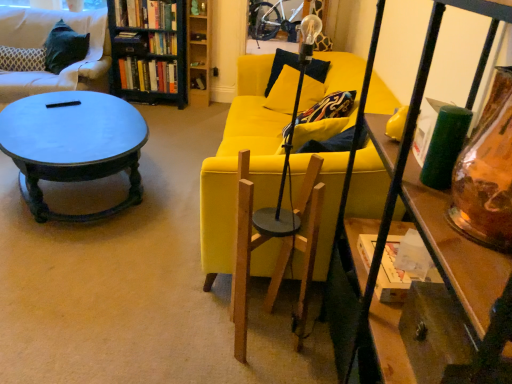
Question: Does hardcover books at upper left, placed as the third book when sorted from bottom to top, have a smaller size compared to hardcover books at upper left, the 3th book from the top?

Choices:
 (A) yes
 (B) no

Answer: (A)

Question: From the image's perspective, is hardcover books at upper left, placed as the third book when sorted from bottom to top, on hardcover books at upper left, the 3th book from the top?

Choices:
 (A) no
 (B) yes

Answer: (B)

Question: Does hardcover books at upper left, placed as the third book when sorted from bottom to top, come behind hardcover books at upper left, the 3th book from the top?

Choices:
 (A) no
 (B) yes

Answer: (A)

Question: Considering the relative positions of hardcover books at upper left, placed as the third book when sorted from bottom to top, and hardcover books at upper left, the 3th book from the top, in the image provided, is hardcover books at upper left, placed as the third book when sorted from bottom to top, to the right of hardcover books at upper left, the 3th book from the top, from the viewer's perspective?

Choices:
 (A) no
 (B) yes

Answer: (B)

Question: Is hardcover books at upper left, which ranks as the first book in bottom-to-top order, located within hardcover books at upper left, arranged as the 1th book when viewed from the top?

Choices:
 (A) yes
 (B) no

Answer: (B)

Question: From the image's perspective, is velvet black pillow at upper left located above or below matte dark blue coffee table at left?

Choices:
 (A) below
 (B) above

Answer: (B)

Question: Is velvet black pillow at upper left in front of or behind matte dark blue coffee table at left in the image?

Choices:
 (A) front
 (B) behind

Answer: (B)

Question: Is point (8, 59) positioned closer to the camera than point (32, 99)?

Choices:
 (A) farther
 (B) closer

Answer: (A)

Question: Is velvet black pillow at upper left spatially inside matte dark blue coffee table at left, or outside of it?

Choices:
 (A) outside
 (B) inside

Answer: (A)

Question: In terms of height, does hardcover books at upper left, which is counted as the second book, starting from the top, look taller or shorter compared to hardcover books at upper left, arranged as the 1th book when viewed from the top?

Choices:
 (A) short
 (B) tall

Answer: (A)

Question: Considering the positions of hardcover books at upper left, which is counted as the second book, starting from the bottom, and hardcover books at upper left, placed as the third book when sorted from bottom to top, in the image, is hardcover books at upper left, which is counted as the second book, starting from the bottom, bigger or smaller than hardcover books at upper left, placed as the third book when sorted from bottom to top,?

Choices:
 (A) big
 (B) small

Answer: (B)

Question: Do you think hardcover books at upper left, which is counted as the second book, starting from the bottom, is within hardcover books at upper left, placed as the third book when sorted from bottom to top, or outside of it?

Choices:
 (A) outside
 (B) inside

Answer: (A)

Question: From a real-world perspective, is hardcover books at upper left, which is counted as the second book, starting from the top, above or below hardcover books at upper left, placed as the third book when sorted from bottom to top?

Choices:
 (A) below
 (B) above

Answer: (A)

Question: Considering the positions of dark gray fabric couch at upper left, the 1th studio couch from the top, and black painted wood bookcase at upper left in the image, is dark gray fabric couch at upper left, the 1th studio couch from the top, bigger or smaller than black painted wood bookcase at upper left?

Choices:
 (A) small
 (B) big

Answer: (A)

Question: From their relative heights in the image, would you say dark gray fabric couch at upper left, the 1th studio couch from the top, is taller or shorter than black painted wood bookcase at upper left?

Choices:
 (A) short
 (B) tall

Answer: (A)